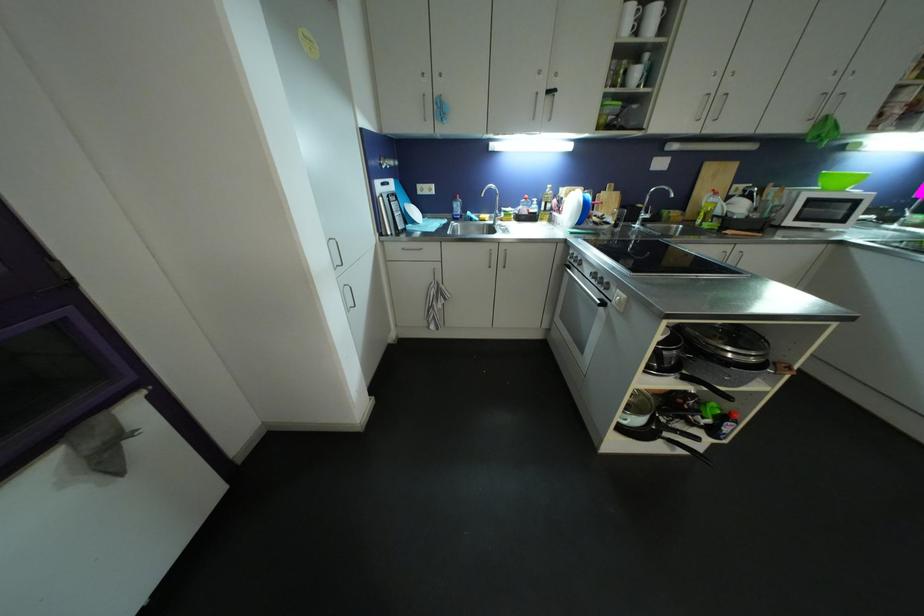
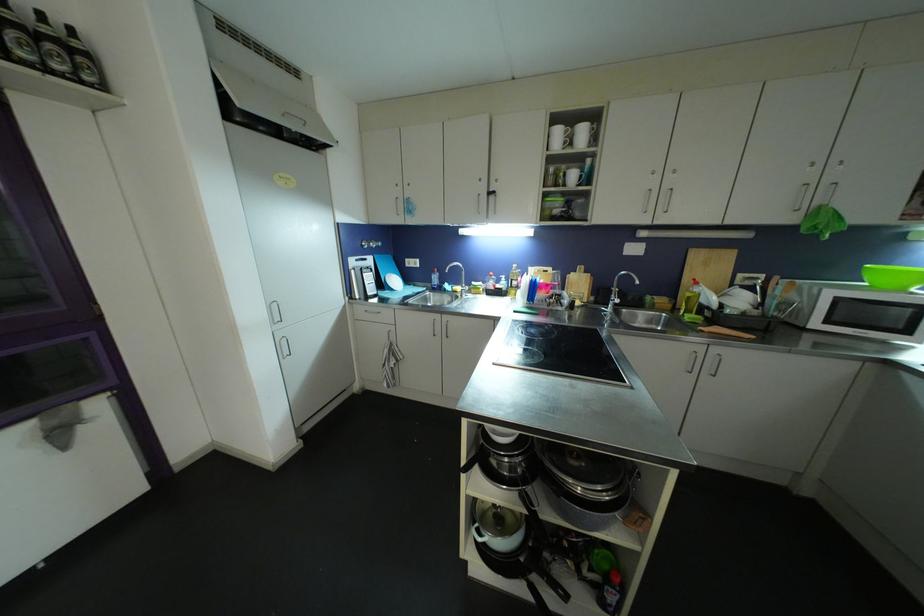
Question: Based on the continuous images, in which direction is the camera rotating? Reply with the corresponding letter.

Choices:
 (A) Left
 (B) Right
 (C) Up
 (D) Down

Answer: (A)